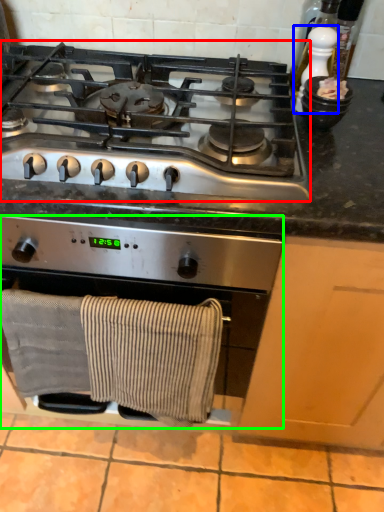
Question: Which object is the closest to the gas stove (highlighted by a red box)? Choose among these: appliance (highlighted by a blue box) or kitchen appliance (highlighted by a green box).

Choices:
 (A) appliance
 (B) kitchen appliance

Answer: (B)